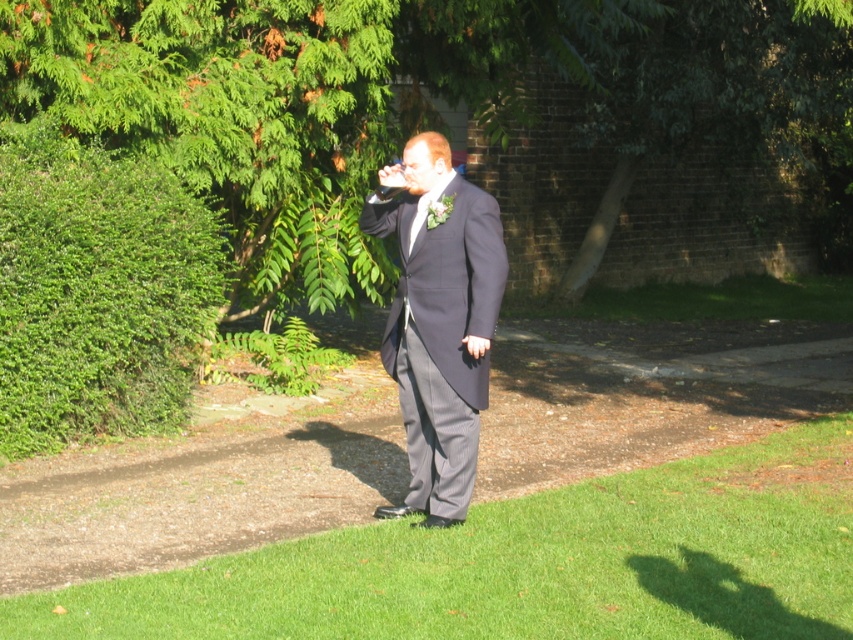
You are a landscape architect designing a garden path. The green grass at lower center and green leafy hedge at left are part of the existing layout. If you need to place a 3.5 meter long bench between them, will there be enough space?

The green grass at lower center and green leafy hedge at left are 3.12 meters apart. Since the bench is 3.5 meters long, it is longer than the available space between them, so there won not be enough space to place the bench between them.

Based on the scene description, if you were standing where the man is, which direction would the green grass at lower center be relative to the green leafy hedge at left?

The green grass at lower center is to the right of the green leafy hedge at left.

Based on the scene, is the green leafy tree at upper left positioned to the right or left side of the dark gray suit at center?

The green leafy tree at upper left is positioned to the right of the dark gray suit at center according to the description.